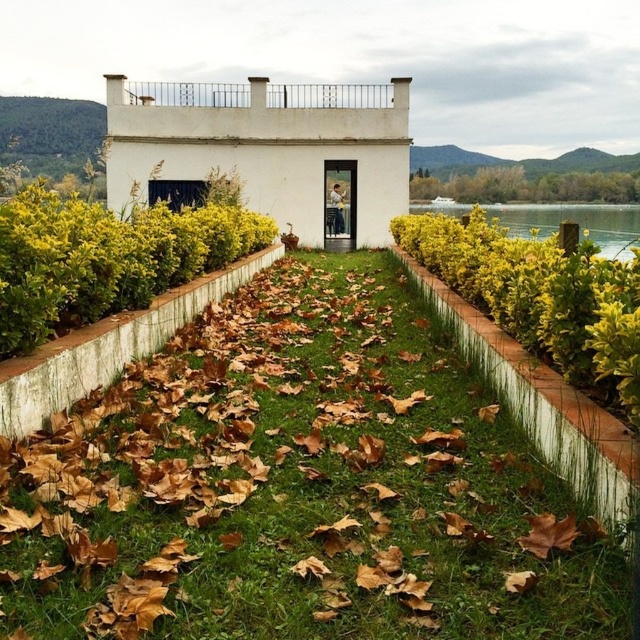
You are standing at the entrance of the small white building and want to walk to the green water at right. Which direction should you go relative to the green grass at center?

To reach the green water at right from the entrance of the building, you should walk away from the green grass at center since the green grass at center is closer to you than the green water at right.

You are planning to place a small garden statue that requires a height of 1 meter to be stable. Based on the scene, which area between the green grass at center and the green water at right would be suitable for placing it?

The green water at right is taller than the green grass at center. Therefore, the statue should be placed in the green water at right since it provides the necessary height for stability.